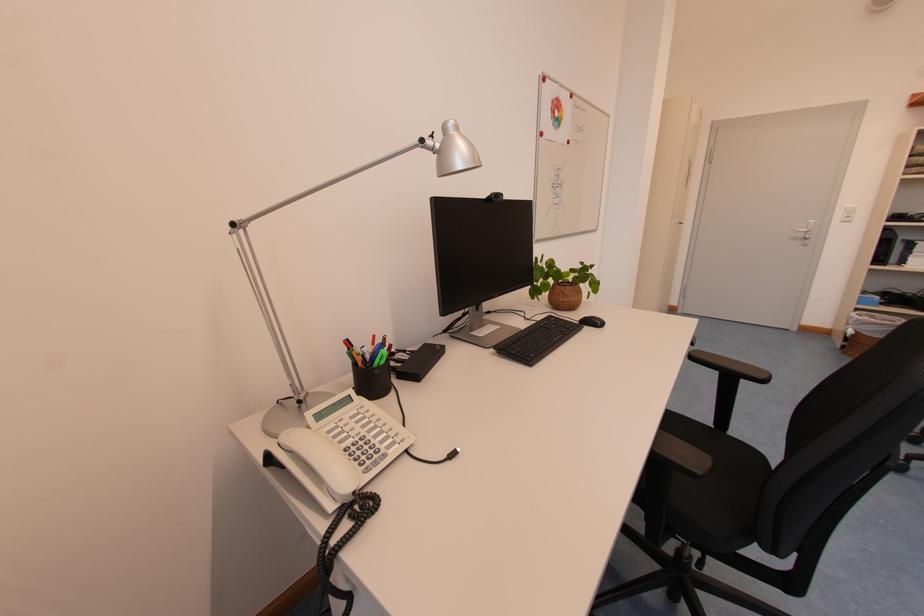
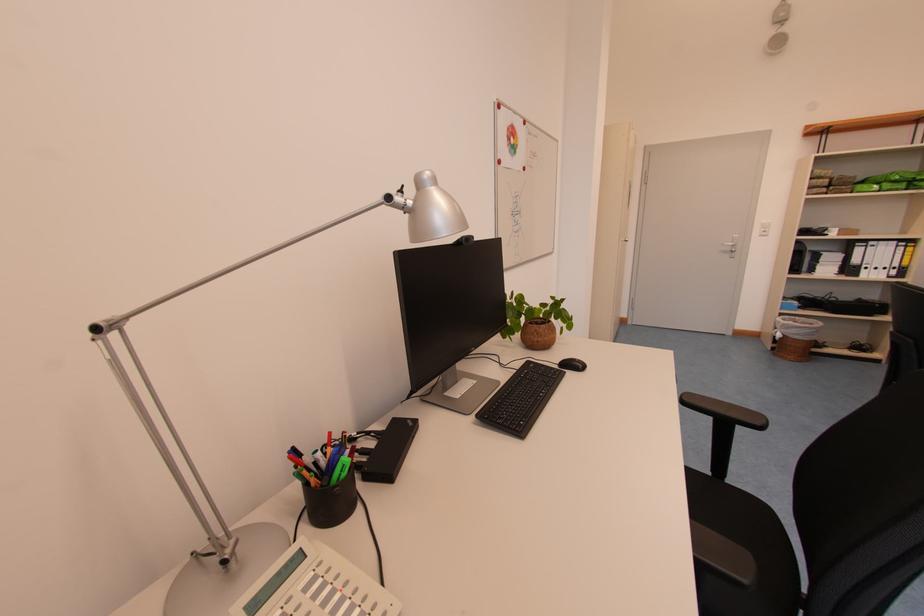
Where in the second image is the point corresponding to pixel 459 124 from the first image?

(434, 175)